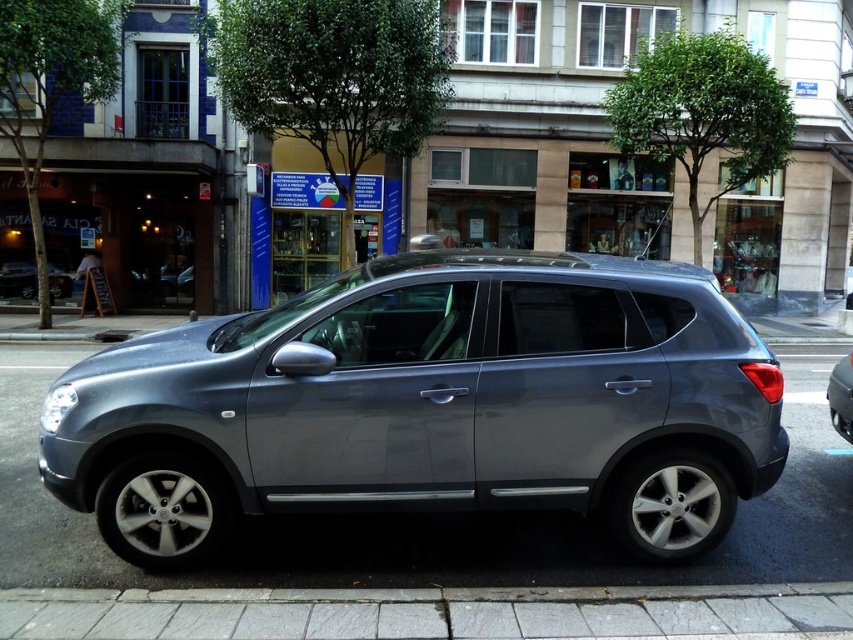
You are a delivery driver who needs to park a delivery van in this parking lot. You see a satin metallic minivan at center and a satin metallic car at center. Which vehicle should you choose to park next to if you want to maximize the space used efficiently?

The satin metallic minivan at center is bigger than the satin metallic car at center, so you should park next to the satin metallic car at center to maximize space efficiency.

You are a delivery driver who needs to park your 5.5 meter long truck behind the satin silver suv at center. The parking space behind the SUV is exactly 6 meters long. Can you safely park your truck there without hitting the SUV in front?

The parking space behind the satin silver suv at center is 6 meters long. Your truck is 5.5 meters long, so there is 0.5 meters of extra space. However, considering the distance between the satin silver suv at center and the camera is 20.18 meters, which might indicate the parking space is sufficient. But typically, a 6m space for a 5.5m truck requires at least 0.5m clearance. However, parking safely also depends on maneuvering space and whether the SUV is positioned correctly. Since the SUV is angled, it M